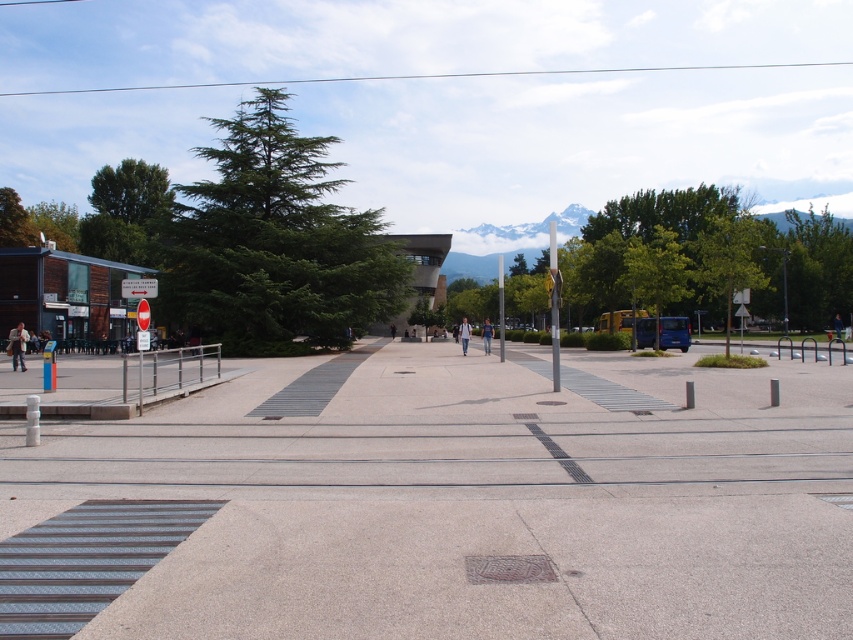
You are a pedestrian standing in the plaza and see a light brown leather jacket at left and denim jeans at center. Which item is closer to the tram tracks in the foreground?

The light brown leather jacket at left is closer to the tram tracks in the foreground because it is positioned under the denim jeans at center, which is further away.

You are a fashion designer observing two pairs of jeans in the plaza. The denim jeans at center and the light blue jeans at center. Which pair is larger in size?

The denim jeans at center is bigger than the light blue jeans at center.

You are standing in the public square and want to find the exact location of the denim jeans at center. According to the coordinates provided, where would you look to find them?

The denim jeans at center are located at the 2D coordinates point (x=486, y=333).